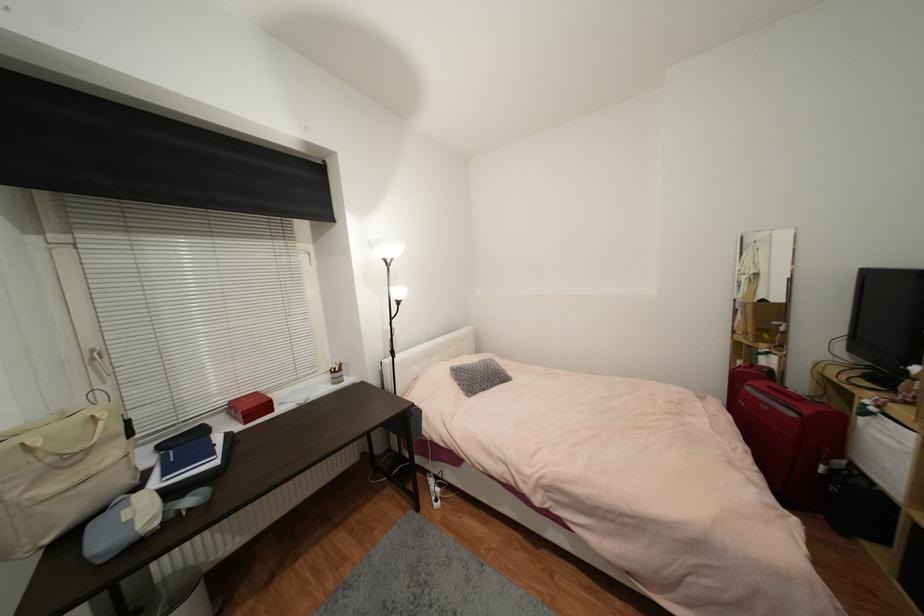
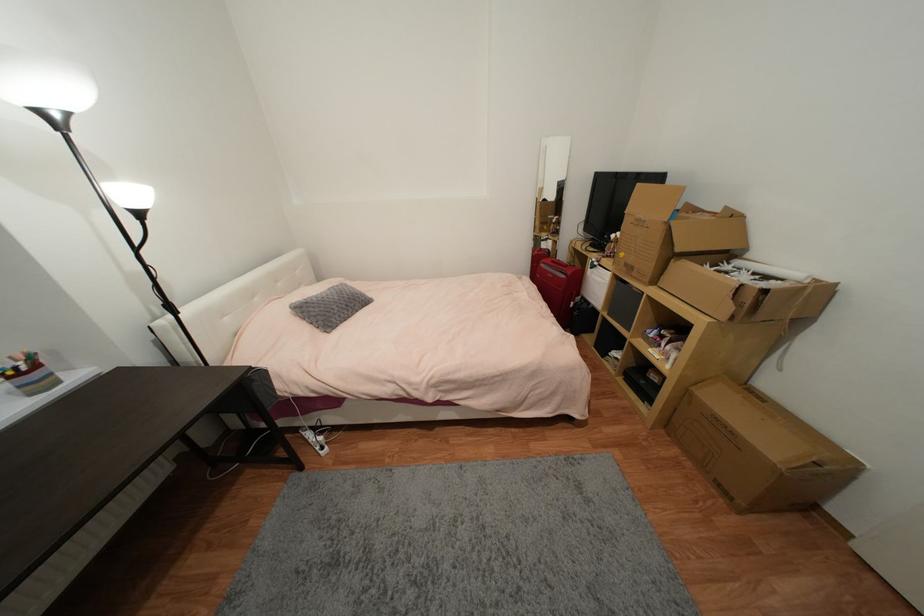
First-person continuous shooting, in which direction is the camera rotating?

The camera rotated toward right-down.